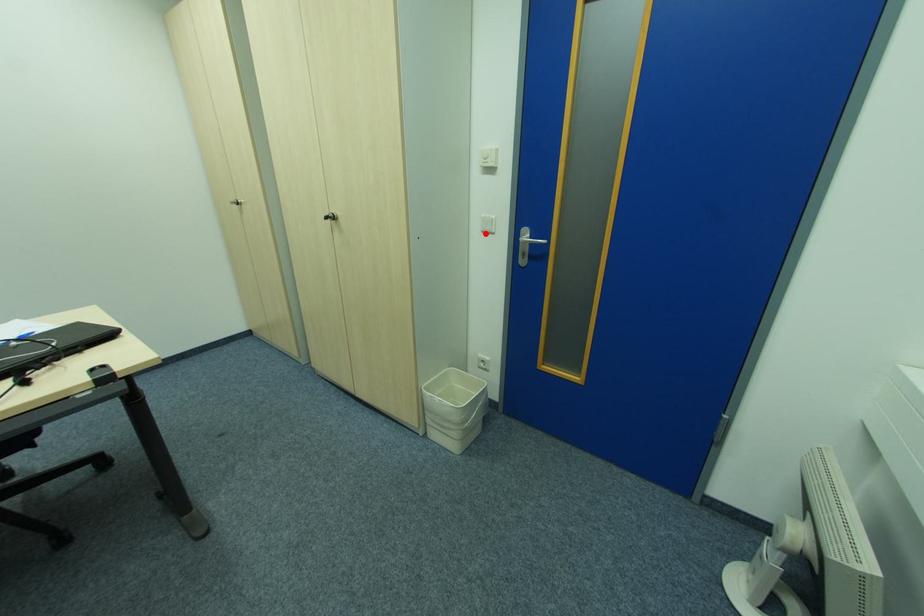
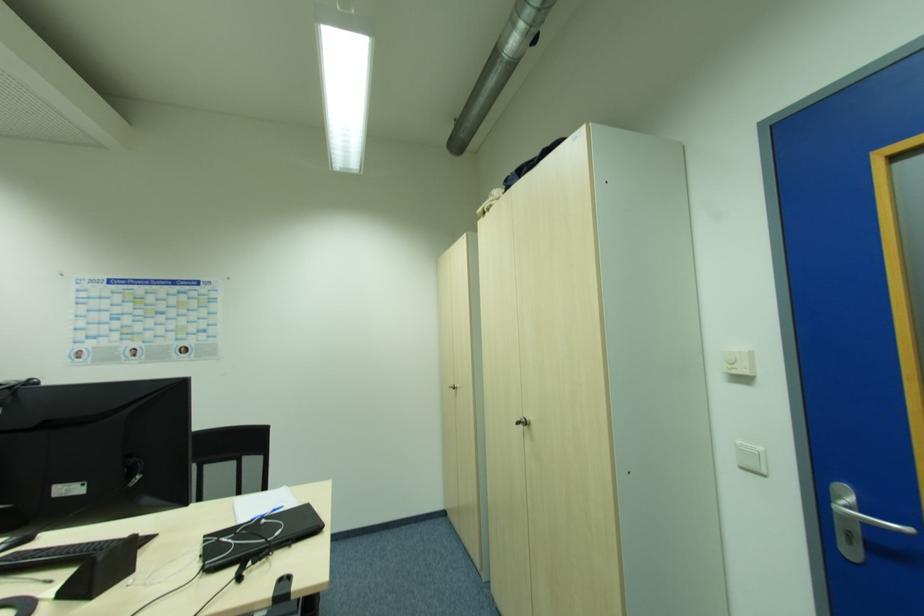
Locate, in the second image, the point that corresponds to the highlighted location in the first image.

(746, 469)